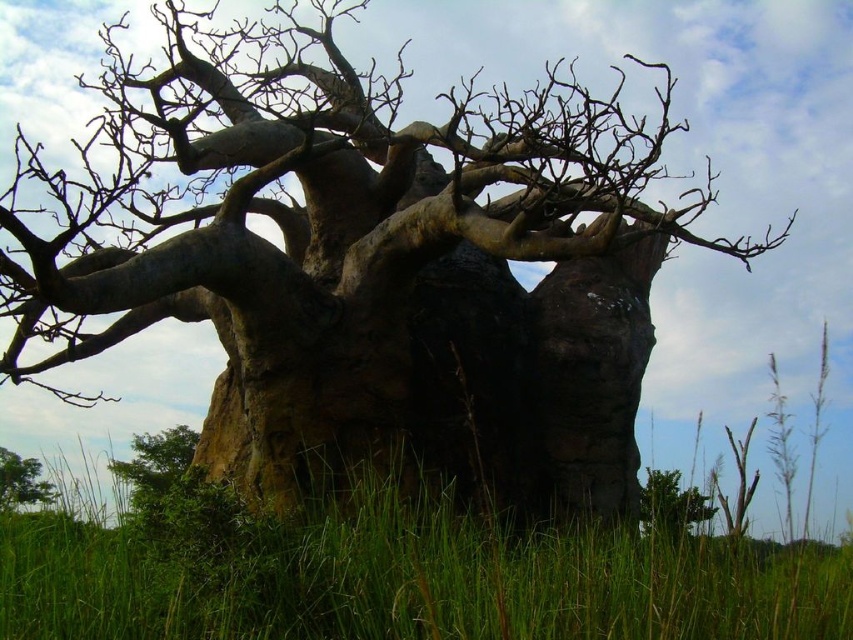
Is green leafy bush at lower left smaller than green rough tree at lower left?

No.

Image resolution: width=853 pixels, height=640 pixels. Describe the element at coordinates (155, 468) in the screenshot. I see `green leafy bush at lower left` at that location.

Image resolution: width=853 pixels, height=640 pixels. In order to click on green leafy bush at lower left in this screenshot , I will do `click(155, 468)`.